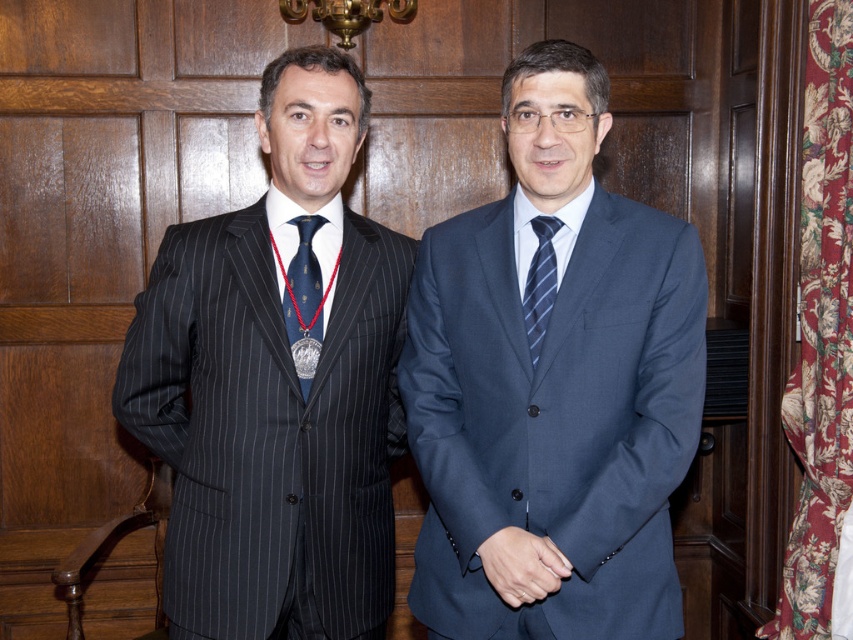
Between blue smooth suit at center and blue striped tie at center, which one appears on the left side from the viewer's perspective?

Positioned to the left is blue striped tie at center.

Is point (457, 416) more distant than point (553, 230)?

That is True.

The height and width of the screenshot is (640, 853). Identify the location of blue smooth suit at center. (553, 387).

Based on the photo, is pinstriped suit at left smaller than blue silk tie at left?

No, pinstriped suit at left is not smaller than blue silk tie at left.

Can you confirm if pinstriped suit at left is bigger than blue silk tie at left?

Yes.

What are the coordinates of `pinstriped suit at left` in the screenshot? It's located at (276, 387).

Does pinstriped suit at left have a greater width compared to blue striped tie at center?

Correct, the width of pinstriped suit at left exceeds that of blue striped tie at center.

Is pinstriped suit at left behind blue striped tie at center?

Yes.

Consider the image. Who is more distant from viewer, (335, 403) or (543, 273)?

The point (335, 403) is more distant.

Identify the location of pinstriped suit at left. (276, 387).